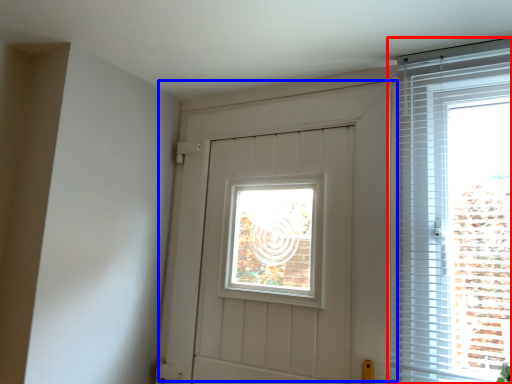
Question: Among these objects, which one is nearest to the camera, window (highlighted by a red box) or door (highlighted by a blue box)?

Choices:
 (A) window
 (B) door

Answer: (A)